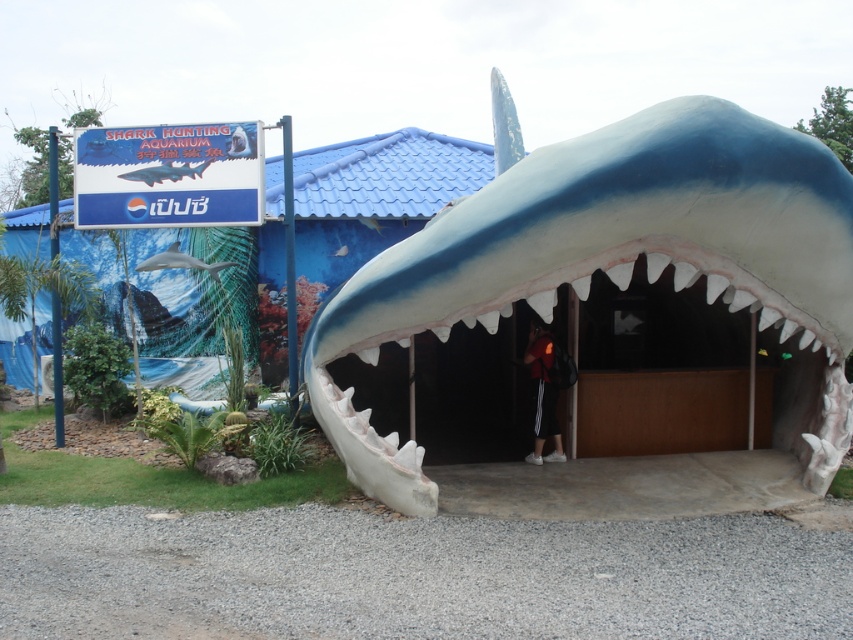
You are a visitor at the Shark Hunting Aquarium and want to take a photo of the white smooth shark at center and the smooth gray shark at upper left. Which shark should you focus on first if you want to capture both in the frame without moving your camera?

You should focus on the white smooth shark at center first because it is taller than the smooth gray shark at upper left, ensuring it fits properly in the frame while still including the smaller one.

You are a tour guide leading a group to the entrance of the attraction. You notice two sharks at the center of the structure. The group asks if they can fit between the two sharks to take a photo. The group consists of four people holding hands, forming a line that is 3.5 meters long. Can they fit through the space between the blue matte shark at center and the white smooth shark at center?

The blue matte shark at center is 4.08 meters from the white smooth shark at center. Since the group is 3.5 meters long, they can fit through the space between the two sharks as the distance is sufficient.